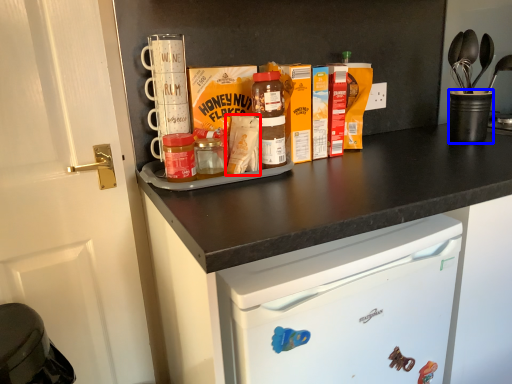
Question: Among these objects, which one is farthest to the camera, cereal (highlighted by a red box) or appliance (highlighted by a blue box)?

Choices:
 (A) cereal
 (B) appliance

Answer: (B)